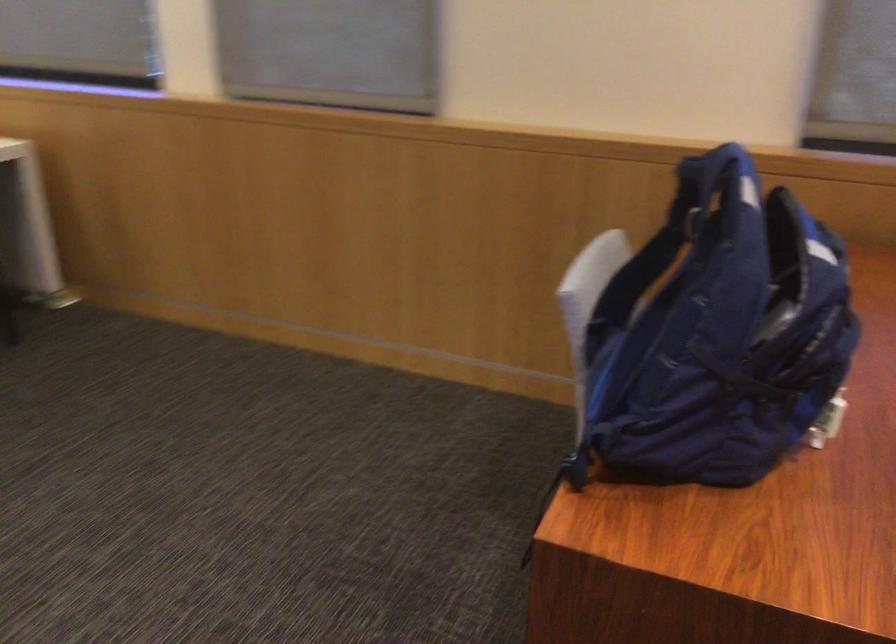
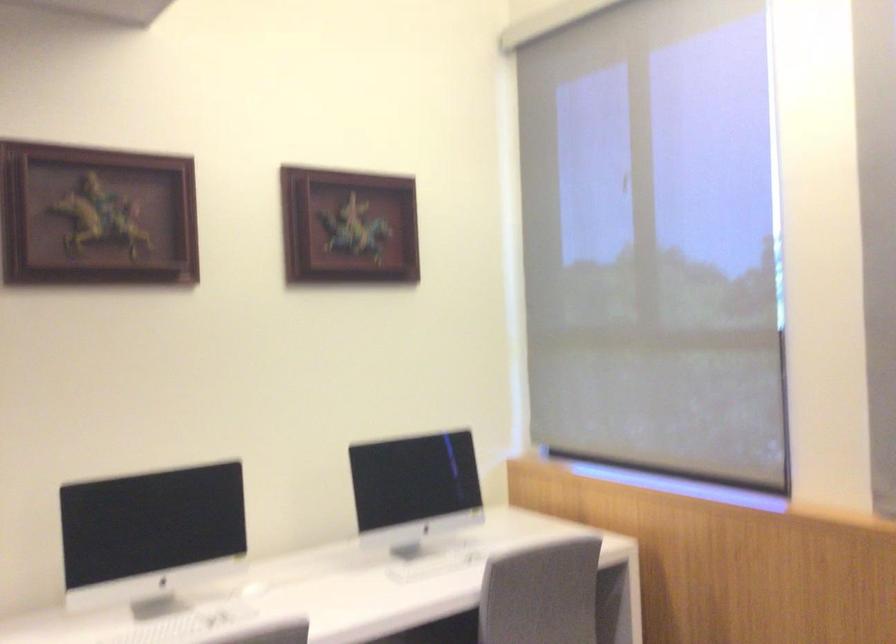
Based on the photo, the images are taken continuously from a first-person perspective. In which direction is your viewpoint rotating?

The camera's rotation is toward left-up.